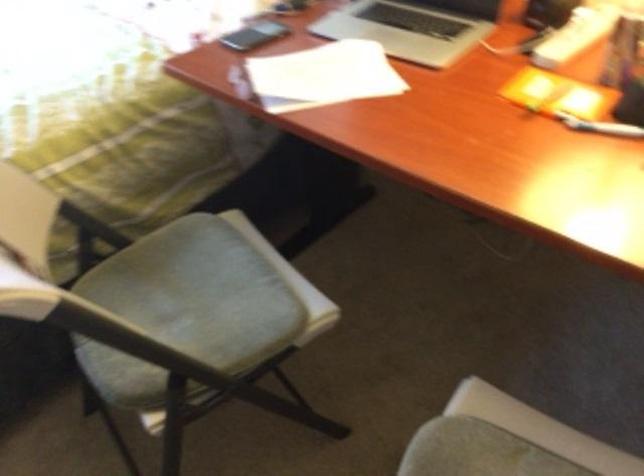
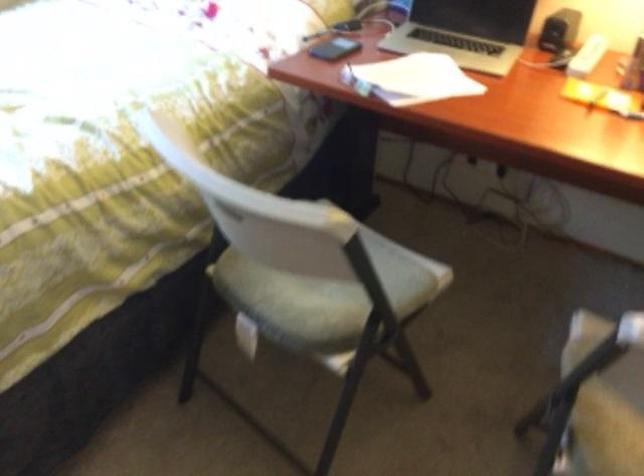
The point at [169,335] is marked in the first image. Where is the corresponding point in the second image?

(317, 298)